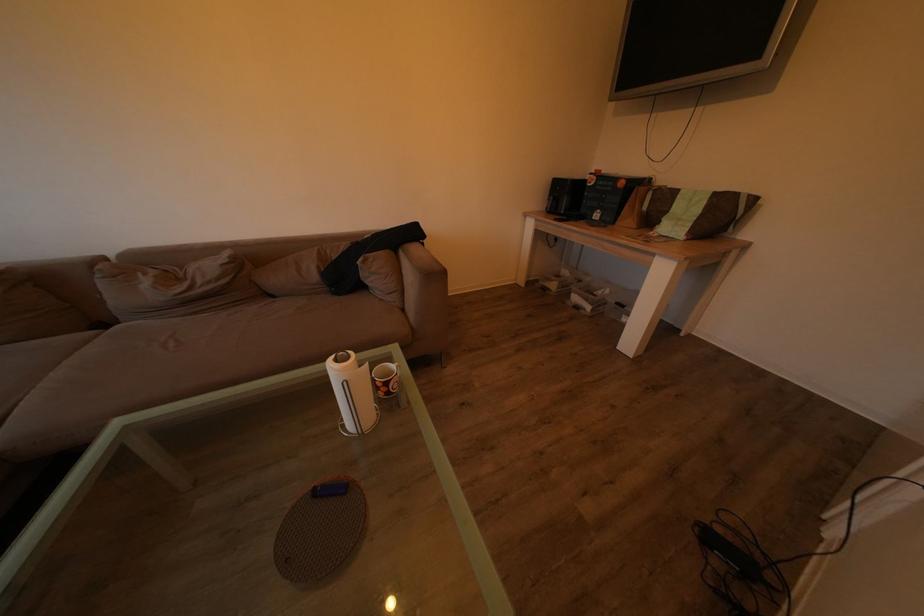
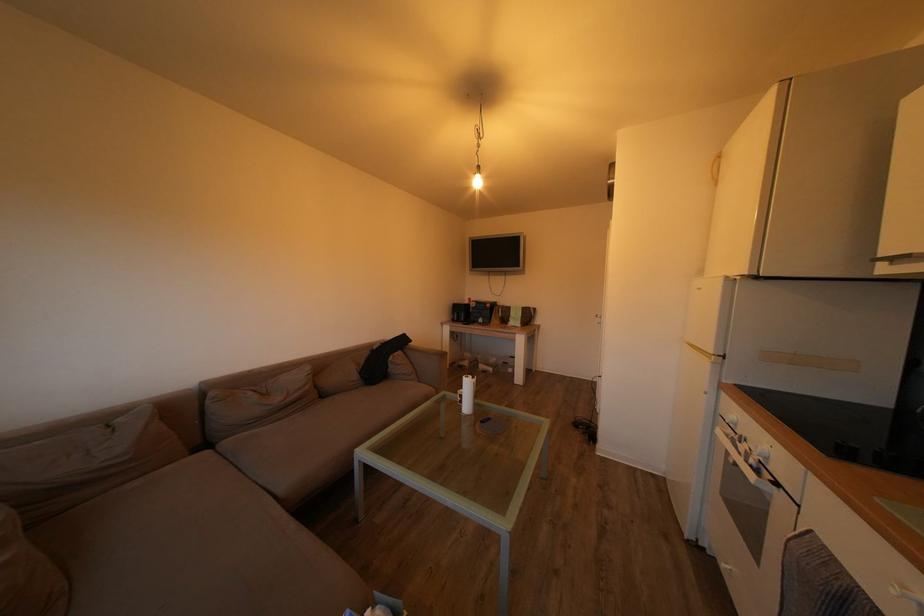
In the second image, find the point that corresponds to the point at 432,243 in the first image.

(419, 347)